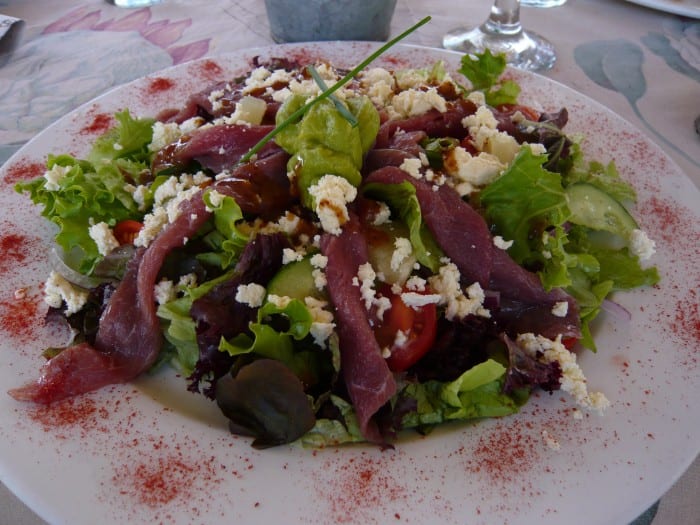
The width and height of the screenshot is (700, 525). In order to click on table cloth in this screenshot , I will do `click(115, 44)`.